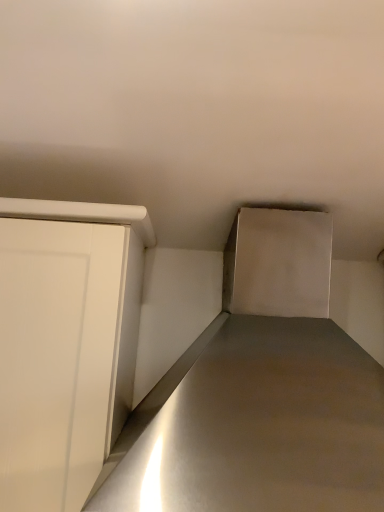
Question: Does point [x=317, y=394] appear closer or farther from the camera than point [x=51, y=366]?

Choices:
 (A) closer
 (B) farther

Answer: (A)

Question: Based on their positions, is satin silver counter top at center located to the left or right of white matte door at left?

Choices:
 (A) right
 (B) left

Answer: (A)

Question: Is satin silver counter top at center spatially inside white matte door at left, or outside of it?

Choices:
 (A) outside
 (B) inside

Answer: (A)

Question: From the image's perspective, relative to satin silver counter top at center, is white matte door at left above or below?

Choices:
 (A) below
 (B) above

Answer: (A)

Question: Is point click(77, 377) closer or farther from the camera than point click(359, 450)?

Choices:
 (A) farther
 (B) closer

Answer: (A)

Question: From a real-world perspective, relative to satin silver counter top at center, is white matte door at left vertically above or below?

Choices:
 (A) below
 (B) above

Answer: (A)

Question: Considering the positions of white matte door at left and satin silver counter top at center in the image, is white matte door at left wider or thinner than satin silver counter top at center?

Choices:
 (A) wide
 (B) thin

Answer: (B)